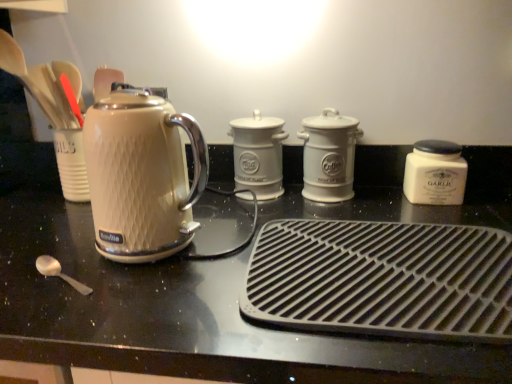
Locate an element on the screen. vacant space behind matte cream kettle at left is located at coordinates (219, 207).